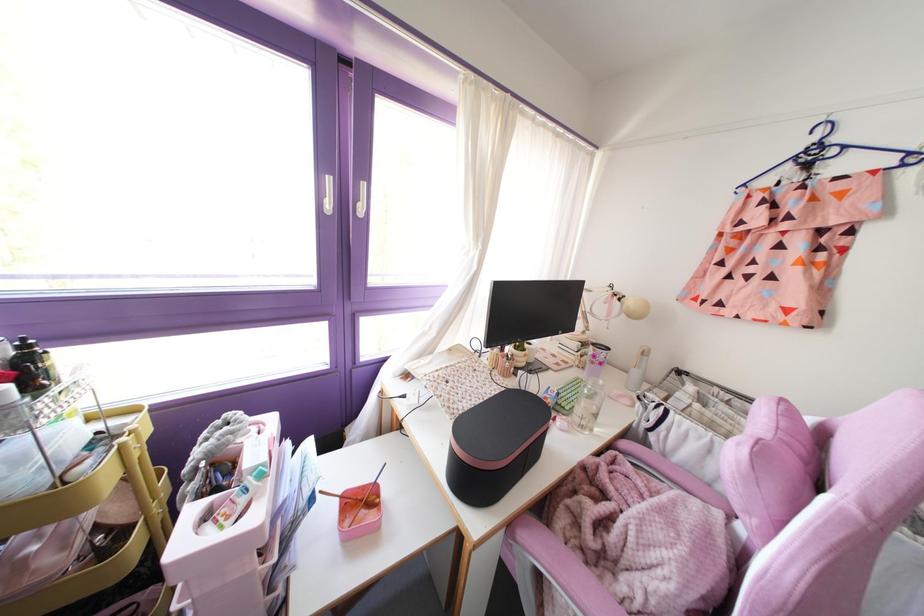
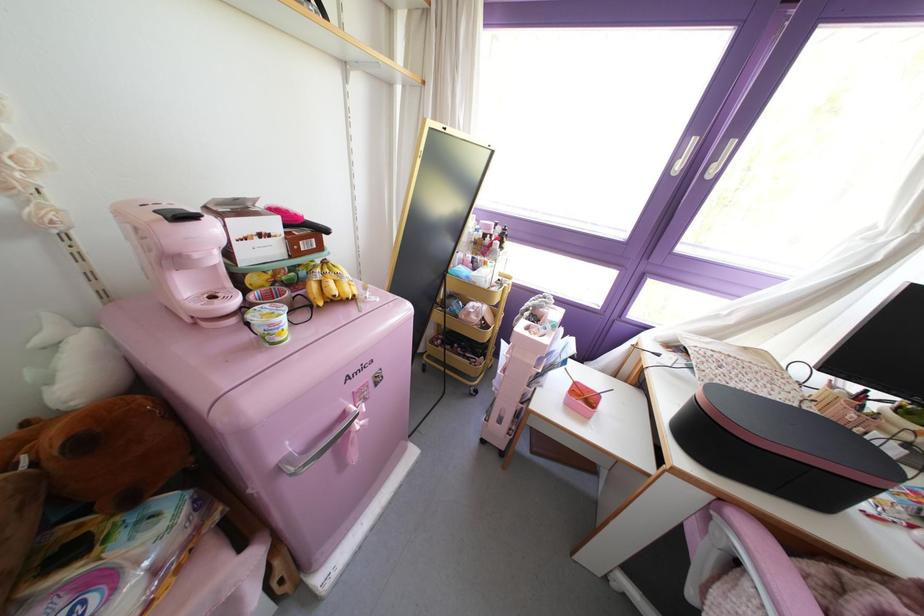
Question: The camera is either moving clockwise (left) or counter-clockwise (right) around the object. The first image is from the beginning of the video and the second image is from the end. Is the camera moving left or right when shooting the video?

Choices:
 (A) Left
 (B) Right

Answer: (B)